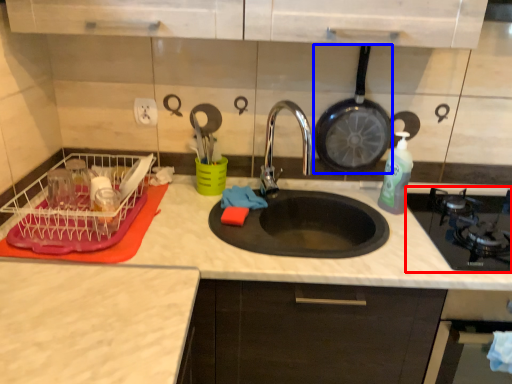
Question: Which object appears farthest to the camera in this image, gas stove (highlighted by a red box) or frying pan (highlighted by a blue box)?

Choices:
 (A) gas stove
 (B) frying pan

Answer: (B)